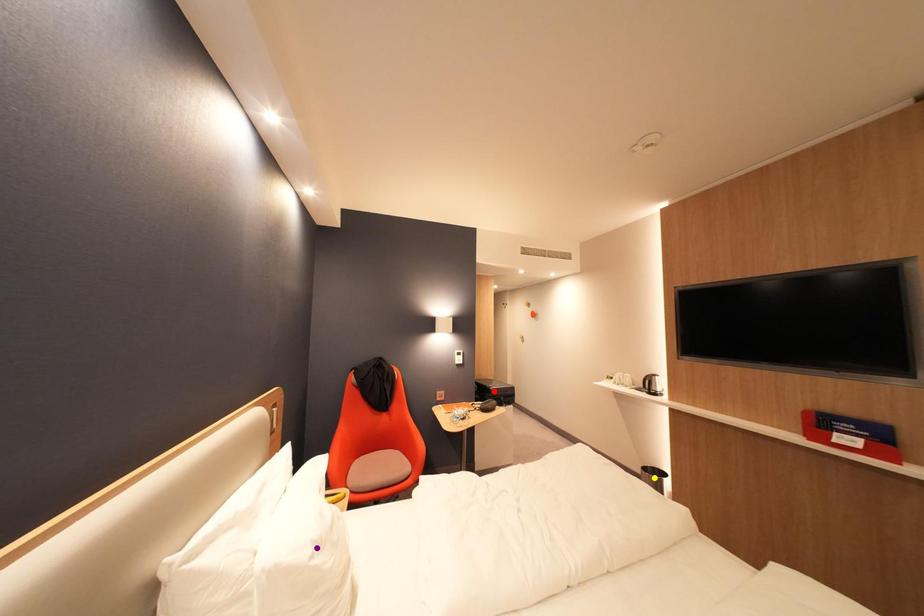
Order these from nearest to farthest:
A) red point
B) purple point
C) yellow point

purple point → yellow point → red point